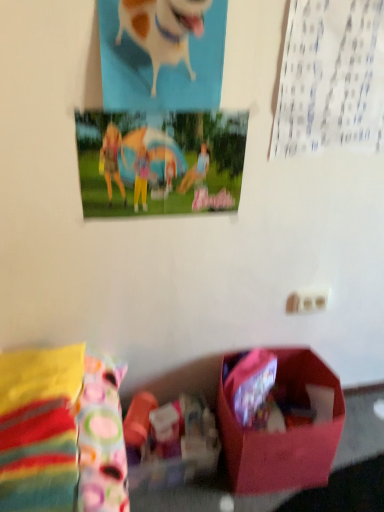
Question: From a real-world perspective, is matte plastic poster at upper center physically located above or below white glossy dog at upper center?

Choices:
 (A) above
 (B) below

Answer: (B)

Question: In terms of height, does matte plastic poster at upper center look taller or shorter compared to white glossy dog at upper center?

Choices:
 (A) short
 (B) tall

Answer: (A)

Question: Considering the real-world distances, which object is farthest from the white glossy dog at upper center?

Choices:
 (A) matte plastic poster at upper center
 (B) matte pink box at lower center

Answer: (B)

Question: Which of these objects is positioned closest to the matte pink box at lower center?

Choices:
 (A) matte plastic poster at upper center
 (B) white glossy dog at upper center

Answer: (A)